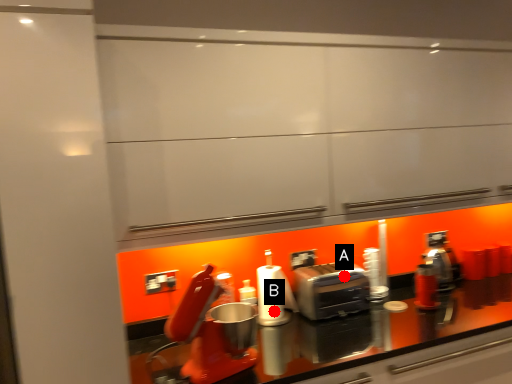
Question: Two points are circled on the image, labeled by A and B beside each circle. Which of the following is the farthest from the observer?

Choices:
 (A) A is further
 (B) B is further

Answer: (A)